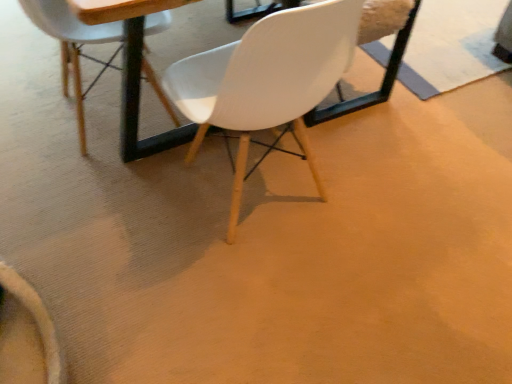
Question: Is wooden round table at center smaller than white matte chair at center, the second chair from the left?

Choices:
 (A) no
 (B) yes

Answer: (A)

Question: Is white matte chair at center, the second chair from the left, a part of wooden round table at center?

Choices:
 (A) yes
 (B) no

Answer: (A)

Question: Is wooden round table at center closer to camera compared to white matte chair at center, acting as the 1th chair starting from the right?

Choices:
 (A) no
 (B) yes

Answer: (A)

Question: From the image's perspective, would you say wooden round table at center is shown under white matte chair at center, the second chair from the left?

Choices:
 (A) yes
 (B) no

Answer: (B)

Question: Are wooden round table at center and white matte chair at center, the second chair from the left, far apart?

Choices:
 (A) no
 (B) yes

Answer: (A)

Question: Is point (339, 52) closer or farther from the camera than point (89, 16)?

Choices:
 (A) closer
 (B) farther

Answer: (B)

Question: Is white matte chair at center, acting as the 1th chair starting from the right, spatially inside wooden round table at center, or outside of it?

Choices:
 (A) outside
 (B) inside

Answer: (B)

Question: Considering the positions of white matte chair at center, acting as the 1th chair starting from the right, and wooden round table at center in the image, is white matte chair at center, acting as the 1th chair starting from the right, bigger or smaller than wooden round table at center?

Choices:
 (A) big
 (B) small

Answer: (B)

Question: From a real-world perspective, is white matte chair at center, the second chair from the left, positioned above or below wooden round table at center?

Choices:
 (A) above
 (B) below

Answer: (A)

Question: Choose the correct answer: Is wooden round table at center inside white matte chair at center, the second chair from the left, or outside it?

Choices:
 (A) inside
 (B) outside

Answer: (B)

Question: From the image's perspective, is wooden round table at center positioned above or below white matte chair at center, acting as the 1th chair starting from the right?

Choices:
 (A) below
 (B) above

Answer: (B)

Question: Considering their positions, is wooden round table at center located in front of or behind white matte chair at center, acting as the 1th chair starting from the right?

Choices:
 (A) front
 (B) behind

Answer: (B)

Question: From their relative heights in the image, would you say wooden round table at center is taller or shorter than white matte chair at center, acting as the 1th chair starting from the right?

Choices:
 (A) tall
 (B) short

Answer: (B)

Question: In terms of height, does matte white chair at upper center, which ranks as the second chair in right-to-left order, look taller or shorter compared to wooden round table at center?

Choices:
 (A) tall
 (B) short

Answer: (B)

Question: Based on their positions, is matte white chair at upper center, which ranks as the second chair in right-to-left order, located to the left or right of wooden round table at center?

Choices:
 (A) right
 (B) left

Answer: (B)